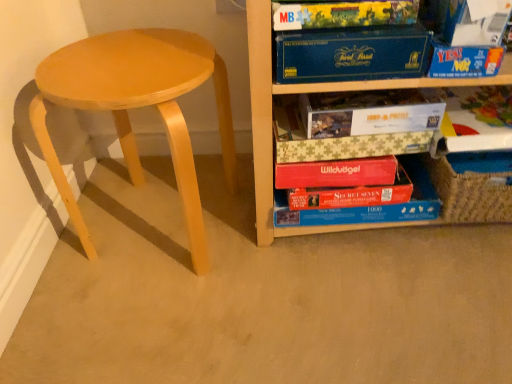
The width and height of the screenshot is (512, 384). Find the location of `wooden puzzle box at right`. wooden puzzle box at right is located at coordinates (304, 92).

The height and width of the screenshot is (384, 512). Identify the location of white cardboard puzzle box at center, arranged as the 1th paperback book when ordered from the bottom. (371, 112).

What do you see at coordinates (351, 54) in the screenshot? I see `blue cardboard box at upper right, which ranks as the second paperback book in bottom-to-top order` at bounding box center [351, 54].

The width and height of the screenshot is (512, 384). Find the location of `white paper at upper right, arranged as the fourth paperback book when ordered from the bottom`. white paper at upper right, arranged as the fourth paperback book when ordered from the bottom is located at coordinates (473, 21).

What do you see at coordinates (344, 14) in the screenshot?
I see `yellow cardboard puzzle box at upper center, which is the 3th paperback book in bottom-to-top order` at bounding box center [344, 14].

Identify the location of matte cardboard book at upper right, the 1th book viewed from the top. Image resolution: width=512 pixels, height=384 pixels. (474, 120).

Does red cardboard puzzle box at lower center, the first book in the bottom-to-top sequence, turn towards white cardboard puzzle box at center, the fourth paperback book in the top-to-bottom sequence?

No, red cardboard puzzle box at lower center, the first book in the bottom-to-top sequence, does not turn towards white cardboard puzzle box at center, the fourth paperback book in the top-to-bottom sequence.

Considering the points (324, 221) and (377, 92), which point is behind, point (324, 221) or point (377, 92)?

Positioned behind is point (324, 221).

Between red cardboard puzzle box at lower center, the first book in the bottom-to-top sequence, and white cardboard puzzle box at center, the fourth paperback book in the top-to-bottom sequence, which one has larger width?

white cardboard puzzle box at center, the fourth paperback book in the top-to-bottom sequence, is wider.

From the image's perspective, between red cardboard puzzle box at lower center, the second book positioned from the right, and white cardboard puzzle box at center, arranged as the 1th paperback book when ordered from the bottom, which one is located above?

white cardboard puzzle box at center, arranged as the 1th paperback book when ordered from the bottom, appears higher in the image.

Between white cardboard puzzle box at center, arranged as the 1th paperback book when ordered from the bottom, and light wood stool at left, which one has more height?

Standing taller between the two is light wood stool at left.

Based on the photo, is white cardboard puzzle box at center, arranged as the 1th paperback book when ordered from the bottom, smaller than light wood stool at left?

Yes.

Consider the image. Is light wood stool at left a part of white cardboard puzzle box at center, the fourth paperback book in the top-to-bottom sequence?

Actually, light wood stool at left is outside white cardboard puzzle box at center, the fourth paperback book in the top-to-bottom sequence.

The width and height of the screenshot is (512, 384). I want to click on the 3rd paperback book in front of the white cardboard puzzle box at center, the fourth paperback book in the top-to-bottom sequence, so click(x=473, y=21).

In terms of height, does white paper at upper right, which is the first paperback book in top-to-bottom order, look taller or shorter compared to white cardboard puzzle box at center, arranged as the 1th paperback book when ordered from the bottom?

In the image, white paper at upper right, which is the first paperback book in top-to-bottom order, appears to be taller than white cardboard puzzle box at center, arranged as the 1th paperback book when ordered from the bottom.

Does white paper at upper right, arranged as the fourth paperback book when ordered from the bottom, contain white cardboard puzzle box at center, arranged as the 1th paperback book when ordered from the bottom?

That's incorrect, white cardboard puzzle box at center, arranged as the 1th paperback book when ordered from the bottom, is not inside white paper at upper right, arranged as the fourth paperback book when ordered from the bottom.

Can you confirm if white paper at upper right, which is the first paperback book in top-to-bottom order, is bigger than white cardboard puzzle box at center, the fourth paperback book in the top-to-bottom sequence?

No, white paper at upper right, which is the first paperback book in top-to-bottom order, is not bigger than white cardboard puzzle box at center, the fourth paperback book in the top-to-bottom sequence.

Considering the relative positions of matte cardboard book at upper right, which ranks as the 2th book in bottom-to-top order, and white cardboard puzzle box at center, arranged as the 1th paperback book when ordered from the bottom, in the image provided, is matte cardboard book at upper right, which ranks as the 2th book in bottom-to-top order, to the left or to the right of white cardboard puzzle box at center, arranged as the 1th paperback book when ordered from the bottom,?

In the image, matte cardboard book at upper right, which ranks as the 2th book in bottom-to-top order, appears on the right side of white cardboard puzzle box at center, arranged as the 1th paperback book when ordered from the bottom.

From the image's perspective, which one is positioned higher, matte cardboard book at upper right, the 1th book viewed from the top, or white cardboard puzzle box at center, the fourth paperback book in the top-to-bottom sequence?

white cardboard puzzle box at center, the fourth paperback book in the top-to-bottom sequence, is shown above in the image.

Which paperback book is the 1st one when counting from the front of the matte cardboard book at upper right, the 1th book viewed from the top? Please provide its 2D coordinates.

[(371, 112)]

Which object is more forward, matte cardboard book at upper right, the 1th book viewed from the top, or white cardboard puzzle box at center, arranged as the 1th paperback book when ordered from the bottom?

Positioned in front is white cardboard puzzle box at center, arranged as the 1th paperback book when ordered from the bottom.

In the scene shown: From the image's perspective, is blue cardboard box at upper right, arranged as the 3th paperback book when viewed from the top, above or below wooden puzzle box at right?

blue cardboard box at upper right, arranged as the 3th paperback book when viewed from the top, is situated higher than wooden puzzle box at right in the image.

Which point is more forward, (344, 40) or (256, 57)?

The point (344, 40) is more forward.

Is the surface of blue cardboard box at upper right, arranged as the 3th paperback book when viewed from the top, in direct contact with wooden puzzle box at right?

No, blue cardboard box at upper right, arranged as the 3th paperback book when viewed from the top, is not touching wooden puzzle box at right.

Is blue cardboard box at upper right, which ranks as the second paperback book in bottom-to-top order, positioned before white cardboard puzzle box at center, the fourth paperback book in the top-to-bottom sequence?

Yes.

In terms of height, does blue cardboard box at upper right, which ranks as the second paperback book in bottom-to-top order, look taller or shorter compared to white cardboard puzzle box at center, the fourth paperback book in the top-to-bottom sequence?

blue cardboard box at upper right, which ranks as the second paperback book in bottom-to-top order, is taller than white cardboard puzzle box at center, the fourth paperback book in the top-to-bottom sequence.

Between point (500, 148) and point (423, 74), which one is positioned in front?

Point (423, 74)

From a real-world perspective, is matte cardboard book at upper right, the first book viewed from the right, physically above blue cardboard box at upper right, which ranks as the second paperback book in bottom-to-top order?

No.

Considering the relative sizes of matte cardboard book at upper right, which ranks as the 2th book in bottom-to-top order, and blue cardboard box at upper right, which ranks as the second paperback book in bottom-to-top order, in the image provided, is matte cardboard book at upper right, which ranks as the 2th book in bottom-to-top order, taller than blue cardboard box at upper right, which ranks as the second paperback book in bottom-to-top order,?

In fact, matte cardboard book at upper right, which ranks as the 2th book in bottom-to-top order, may be shorter than blue cardboard box at upper right, which ranks as the second paperback book in bottom-to-top order.

Locate an element on the screen. book lying on the left of white cardboard puzzle box at center, arranged as the 1th paperback book when ordered from the bottom is located at coordinates (369, 206).

Locate an element on the screen. The image size is (512, 384). the 1st paperback book above the light wood stool at left (from a real-world perspective) is located at coordinates (371, 112).

When comparing their distances from white paper at upper right, which is the first paperback book in top-to-bottom order, does wooden puzzle box at right or yellow cardboard puzzle box at upper center, which is the 3th paperback book in bottom-to-top order, seem further?

The object further to white paper at upper right, which is the first paperback book in top-to-bottom order, is wooden puzzle box at right.

Based on their spatial positions, is red cardboard puzzle box at lower center, the 1th book viewed from the left, or yellow cardboard puzzle box at upper center, which is the 3th paperback book in bottom-to-top order, further from wooden puzzle box at right?

yellow cardboard puzzle box at upper center, which is the 3th paperback book in bottom-to-top order.

From the image, which object appears to be farther from wooden puzzle box at right, light wood stool at left or yellow cardboard puzzle box at upper center, which is the 3th paperback book in bottom-to-top order?

light wood stool at left is positioned further to the anchor wooden puzzle box at right.

Looking at this image, considering their positions, is yellow cardboard puzzle box at upper center, which is the 3th paperback book in bottom-to-top order, positioned further to matte cardboard book at upper right, the first book viewed from the right, than white cardboard puzzle box at center, the fourth paperback book in the top-to-bottom sequence?

The object further to matte cardboard book at upper right, the first book viewed from the right, is yellow cardboard puzzle box at upper center, which is the 3th paperback book in bottom-to-top order.

Estimate the real-world distances between objects in this image. Which object is closer to light wood stool at left, red cardboard puzzle box at lower center, the first book in the bottom-to-top sequence, or yellow cardboard puzzle box at upper center, which is the 3th paperback book in bottom-to-top order?

yellow cardboard puzzle box at upper center, which is the 3th paperback book in bottom-to-top order.

From the image, which object appears to be nearer to red cardboard puzzle box at lower center, marked as the second book in a top-to-bottom arrangement, light wood stool at left or white cardboard puzzle box at center, the fourth paperback book in the top-to-bottom sequence?

white cardboard puzzle box at center, the fourth paperback book in the top-to-bottom sequence, lies closer to red cardboard puzzle box at lower center, marked as the second book in a top-to-bottom arrangement, than the other object.

Which object lies further to the anchor point blue cardboard box at upper right, which ranks as the second paperback book in bottom-to-top order, light wood stool at left or red cardboard puzzle box at lower center, marked as the second book in a top-to-bottom arrangement?

Among the two, light wood stool at left is located further to blue cardboard box at upper right, which ranks as the second paperback book in bottom-to-top order.

Based on their spatial positions, is yellow cardboard puzzle box at upper center, which is the 3th paperback book in bottom-to-top order, or light wood stool at left further from red cardboard puzzle box at lower center, marked as the second book in a top-to-bottom arrangement?

yellow cardboard puzzle box at upper center, which is the 3th paperback book in bottom-to-top order, is further to red cardboard puzzle box at lower center, marked as the second book in a top-to-bottom arrangement.

Find the location of a particular element. Image resolution: width=512 pixels, height=384 pixels. book between light wood stool at left and white cardboard puzzle box at center, the fourth paperback book in the top-to-bottom sequence, from left to right is located at coordinates (369, 206).

Locate an element on the screen. The image size is (512, 384). book between light wood stool at left and matte cardboard book at upper right, the first book viewed from the right, from left to right is located at coordinates (369, 206).

Find the location of a particular element. The image size is (512, 384). shelf situated between yellow cardboard puzzle box at upper center, which ranks as the 2th paperback book in top-to-bottom order, and white paper at upper right, which is the first paperback book in top-to-bottom order, from left to right is located at coordinates (304, 92).

Locate an element on the screen. This screenshot has height=384, width=512. shelf between yellow cardboard puzzle box at upper center, which is the 3th paperback book in bottom-to-top order, and matte cardboard book at upper right, the first book viewed from the right, in the horizontal direction is located at coordinates (304, 92).